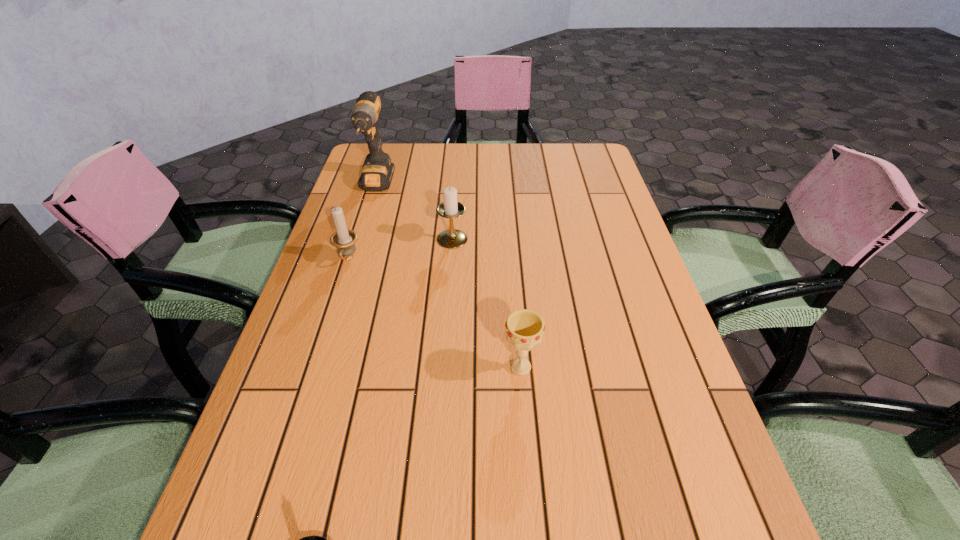
Find the location of a particular element. vacant space that's between the second object from right to left and the leftmost candle holder is located at coordinates (400, 249).

The height and width of the screenshot is (540, 960). In order to click on object that ranks as the closest to the tallest object in this screenshot , I will do coord(344,240).

You are a GUI agent. You are given a task and a screenshot of the screen. Output one action in this format:
    pyautogui.click(x=<x>, y=<y>)
    Task: Click on the object that is the third closest to the leftmost candle holder
    
    Given the screenshot: What is the action you would take?
    pyautogui.click(x=524, y=328)

The height and width of the screenshot is (540, 960). I want to click on candle holder that stands as the second closest to the rightmost candle holder, so click(314, 539).

Select which candle holder is the third closest to the fourth farthest object. Please provide its 2D coordinates. Your answer should be formatted as a tuple, i.e. [(x, y)], where the tuple contains the x and y coordinates of a point satisfying the conditions above.

[(344, 240)]

Where is `free space that satisfies the following two spatial constraints: 1. on the handle side of the leftmost candle holder; 2. on the left side of the fourth farthest object`? This screenshot has height=540, width=960. free space that satisfies the following two spatial constraints: 1. on the handle side of the leftmost candle holder; 2. on the left side of the fourth farthest object is located at coordinates (313, 367).

Identify the location of vacant space that satisfies the following two spatial constraints: 1. on the front side of the fourth farthest object; 2. on the right side of the rightmost candle holder. (444, 367).